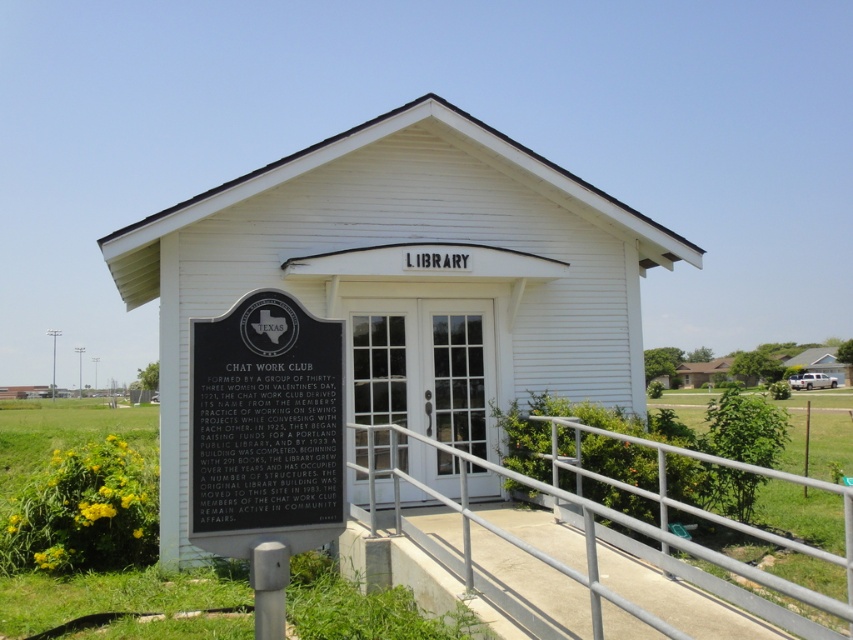
You are standing in front of the library and want to take a photo of the white wooden church at center. Which direction should you face to ensure the church is in the center of your photo?

The white wooden church at center is already positioned at the center of the image, so facing directly towards the library entrance will keep it centered in your photo.